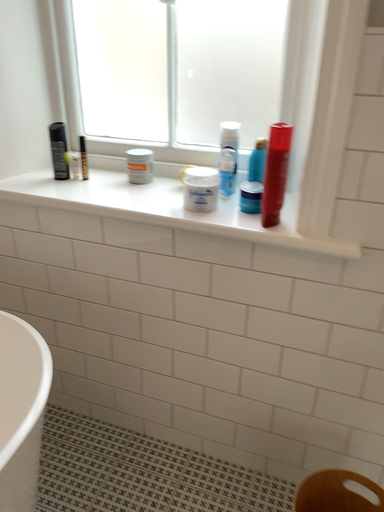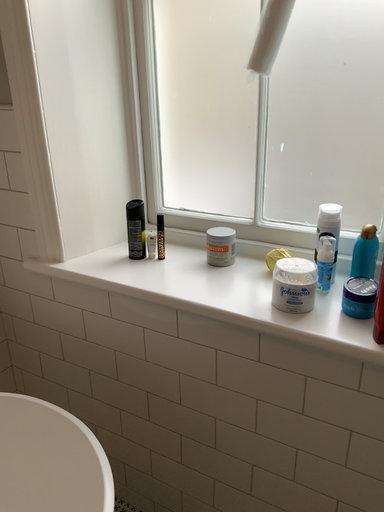
Question: How did the camera likely rotate when shooting the video?

Choices:
 (A) rotated left
 (B) rotated right

Answer: (A)